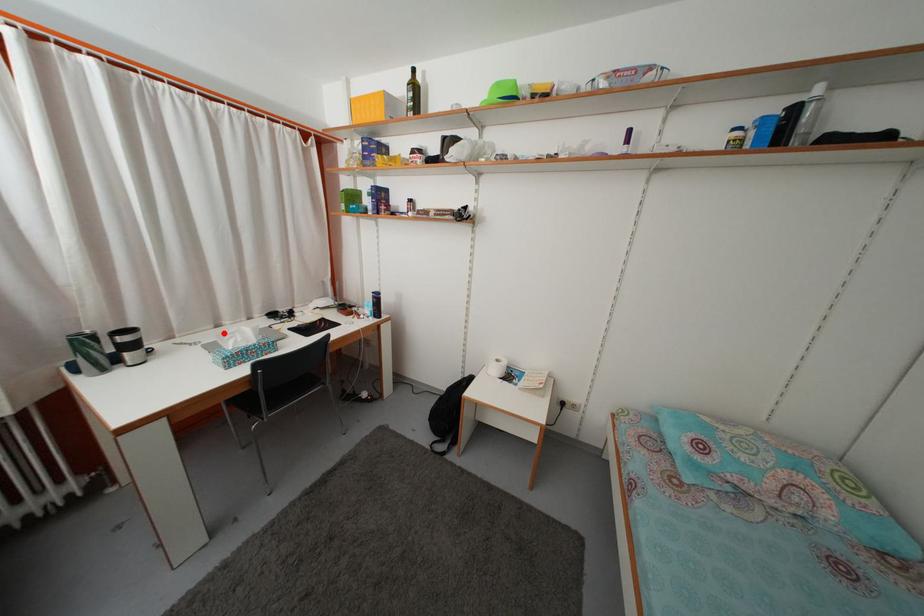
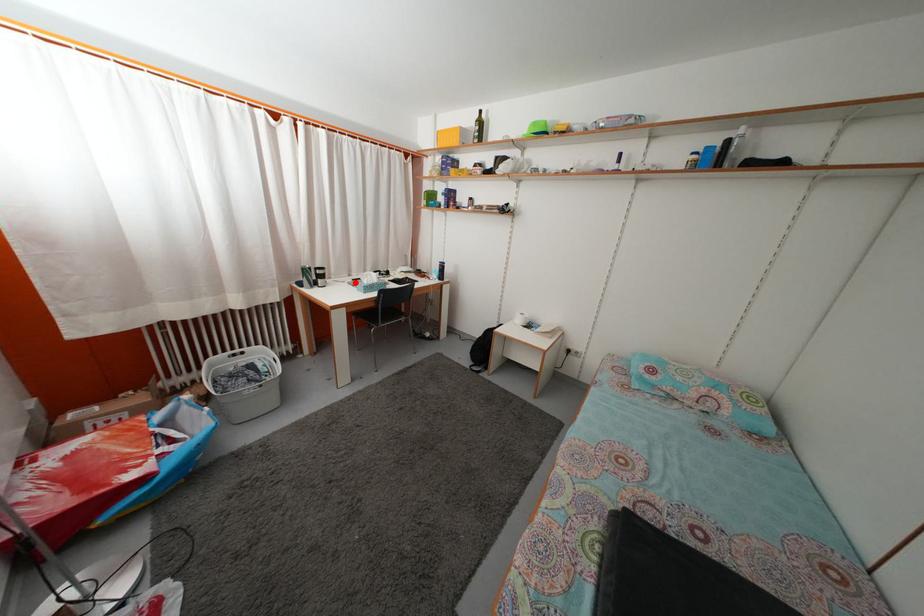
I am providing you with two images of the same scene from different viewpoints. A red point is marked on the first image and another point is marked on the second image. Does the point marked in image1 correspond to the same location as the one in image2?

Yes